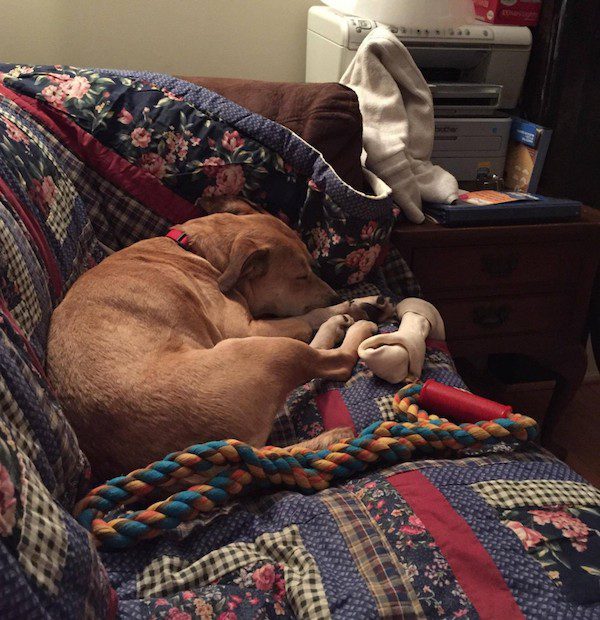
The height and width of the screenshot is (620, 600). In order to click on side table in this screenshot , I will do `click(486, 235)`.